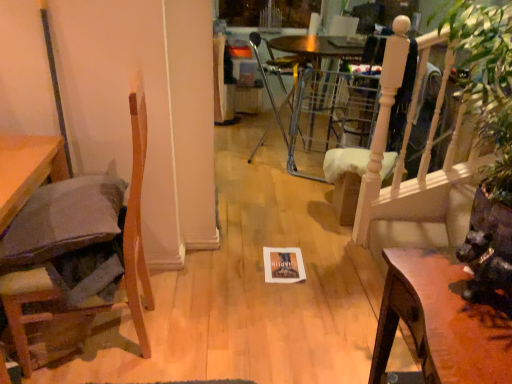
The image size is (512, 384). Find the location of `vacant space to the right of wooden chair at left, marked as the 1th chair in a left-to-right arrangement`. vacant space to the right of wooden chair at left, marked as the 1th chair in a left-to-right arrangement is located at coordinates (208, 331).